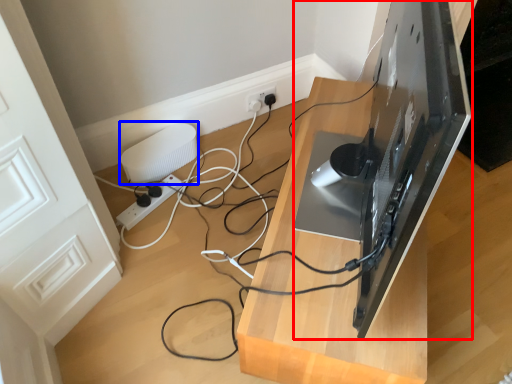
Question: Which object appears closest to the camera in this image, desktop computer (highlighted by a red box) or appliance (highlighted by a blue box)?

Choices:
 (A) desktop computer
 (B) appliance

Answer: (A)